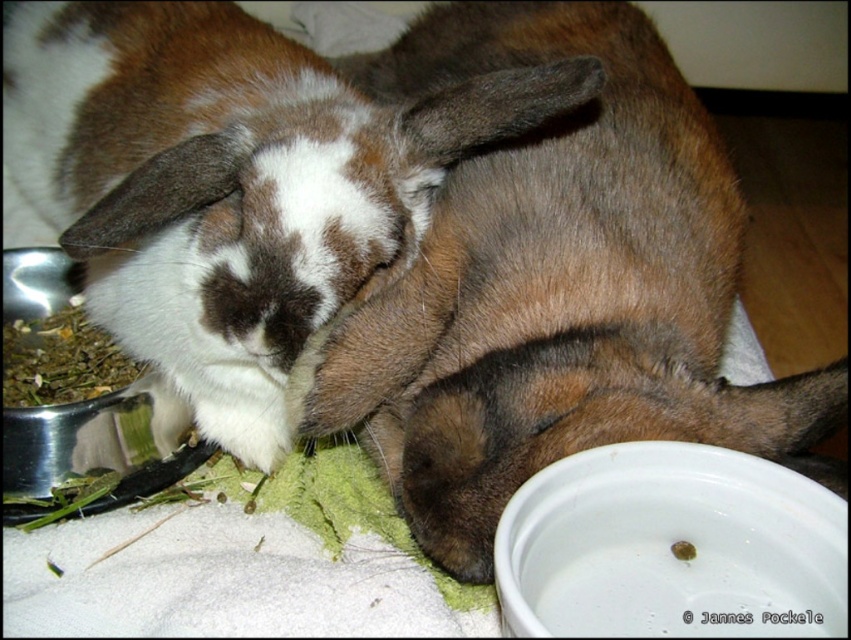
The height and width of the screenshot is (640, 851). Describe the element at coordinates (101, 444) in the screenshot. I see `metallic silver bowl at lower left` at that location.

Who is more forward, (50, 292) or (12, 355)?

Point (12, 355)

Is point (16, 436) more distant than point (67, 381)?

No, (16, 436) is in front of (67, 381).

Where is `metallic silver bowl at lower left`? The width and height of the screenshot is (851, 640). metallic silver bowl at lower left is located at coordinates (101, 444).

Is white glossy bowl at lower right behind green leafy material at left?

That is False.

Based on the photo, which is more to the left, white glossy bowl at lower right or green leafy material at left?

green leafy material at left

The width and height of the screenshot is (851, 640). What do you see at coordinates (670, 547) in the screenshot?
I see `white glossy bowl at lower right` at bounding box center [670, 547].

Where is `white glossy bowl at lower right`? white glossy bowl at lower right is located at coordinates (670, 547).

Is point (564, 412) less distant than point (111, 435)?

Yes, point (564, 412) is closer to viewer.

Locate an element on the screen. The height and width of the screenshot is (640, 851). brown fur rabbit at center is located at coordinates (555, 288).

Where is `brown fur rabbit at center`? The width and height of the screenshot is (851, 640). brown fur rabbit at center is located at coordinates (555, 288).